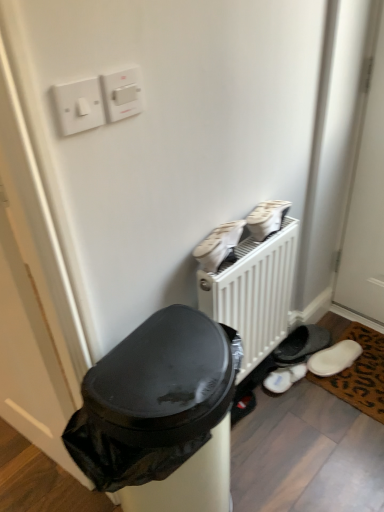
The width and height of the screenshot is (384, 512). I want to click on free space above black plastic trash can at lower left (from a real-world perspective), so click(x=160, y=365).